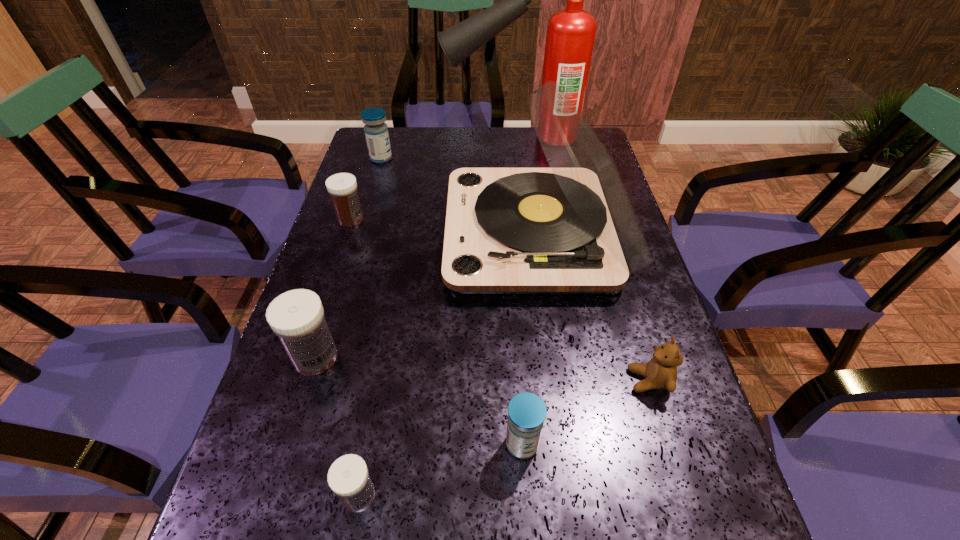
This screenshot has width=960, height=540. Identify the location of fire extinguisher that is at the right edge. [x=570, y=36].

Where is `record player present at the right edge`? record player present at the right edge is located at coordinates (569, 229).

Locate an element on the screen. teddy bear present at the right edge is located at coordinates (660, 372).

This screenshot has height=540, width=960. I want to click on object that is positioned at the far left corner, so click(x=376, y=131).

At what (x,y) coordinates should I click in order to perform the action: click on object present at the far right corner. Please return your answer as a coordinate pair (x, y). The image size is (960, 540). Looking at the image, I should click on (570, 36).

Image resolution: width=960 pixels, height=540 pixels. In the image, there is a desktop. What are the coordinates of `free space at the far edge` in the screenshot? It's located at (451, 142).

Find the location of a particular element. The height and width of the screenshot is (540, 960). free space at the left edge of the desktop is located at coordinates (356, 237).

At what (x,y) coordinates should I click in order to perform the action: click on vacant space at the right edge of the desktop. Please return your answer as a coordinate pair (x, y). Looking at the image, I should click on (630, 336).

The image size is (960, 540). Identify the location of free spot at the far left corner of the desktop. (391, 136).

I want to click on free space between the farthest object and the nearest white medicine, so click(439, 316).